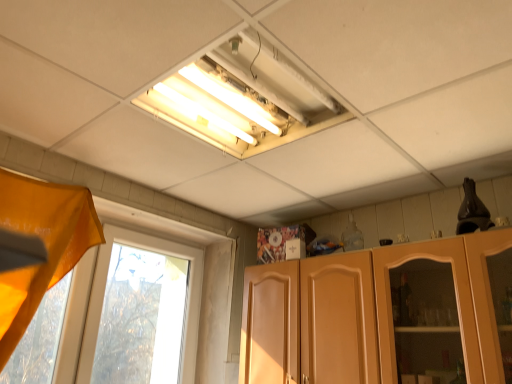
Question: Does point (195, 264) appear closer or farther from the camera than point (314, 354)?

Choices:
 (A) closer
 (B) farther

Answer: (B)

Question: Looking at the image, does transparent glass window at left seem bigger or smaller compared to matte wood cabinet at lower right?

Choices:
 (A) big
 (B) small

Answer: (B)

Question: Based on their relative distances, which object is nearer to the transparent glass window at left?

Choices:
 (A) matte wood cabinet at lower right
 (B) orange fabric curtain at left

Answer: (B)

Question: Based on their relative distances, which object is farther from the matte wood cabinet at lower right?

Choices:
 (A) transparent glass window at left
 (B) orange fabric curtain at left

Answer: (B)